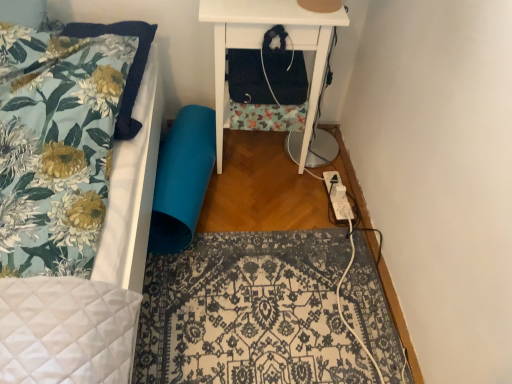
Image resolution: width=512 pixels, height=384 pixels. I want to click on vacant area situated below white matte nightstand at upper right (from a real-world perspective), so click(x=241, y=155).